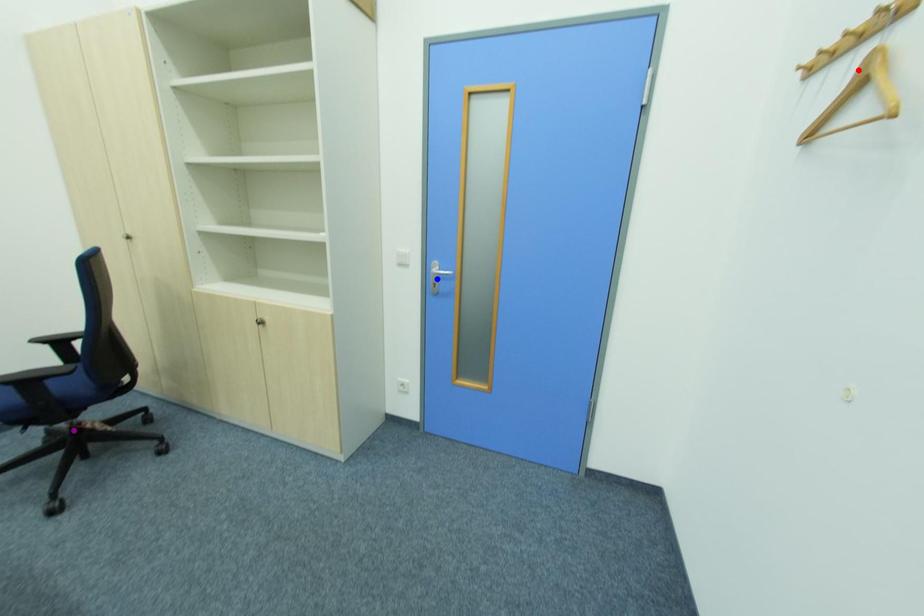
Order these from nearest to farthest:
A) red point
B) blue point
C) purple point

red point, purple point, blue point